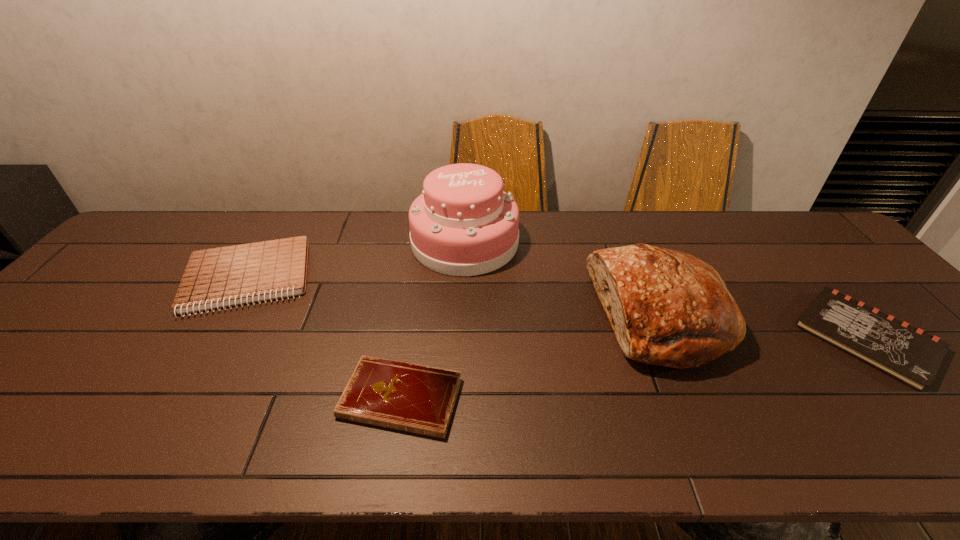
Image resolution: width=960 pixels, height=540 pixels. In the image, there is a desktop. Find the location of `vacant region at the far right corner`. vacant region at the far right corner is located at coordinates (765, 216).

Where is `free space between the bread and the leftmost object`? Image resolution: width=960 pixels, height=540 pixels. free space between the bread and the leftmost object is located at coordinates tap(453, 298).

The width and height of the screenshot is (960, 540). Identify the location of vacant space in between the leftmost notebook and the bread. (453, 298).

Image resolution: width=960 pixels, height=540 pixels. Identify the location of empty space between the tallest object and the leftmost object. (356, 260).

Find the location of `free spot between the third tallest object and the birthday cake`. free spot between the third tallest object and the birthday cake is located at coordinates (356, 260).

The width and height of the screenshot is (960, 540). Identify the location of free space between the leftmost notebook and the fourth shortest object. (453, 298).

The image size is (960, 540). Identify the location of empty space between the leftmost object and the birthday cake. (356, 260).

Locate an element on the screen. free area in between the birthday cake and the third tallest object is located at coordinates (356, 260).

Choose which object is the fourth nearest neighbor to the rightmost object. Please provide its 2D coordinates. Your answer should be formatted as a tuple, i.e. [(x, y)], where the tuple contains the x and y coordinates of a point satisfying the conditions above.

[(227, 276)]

You are a GUI agent. You are given a task and a screenshot of the screen. Output one action in this format:
    pyautogui.click(x=<x>, y=<y>)
    Task: Click on the second closest object to the birthday cake
    The width and height of the screenshot is (960, 540).
    Given the screenshot: What is the action you would take?
    pyautogui.click(x=227, y=276)